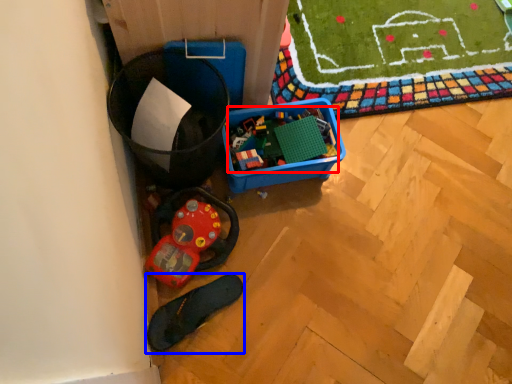
Question: Which object appears closest to the camera in this image, toy (highlighted by a red box) or footwear (highlighted by a blue box)?

Choices:
 (A) toy
 (B) footwear

Answer: (B)